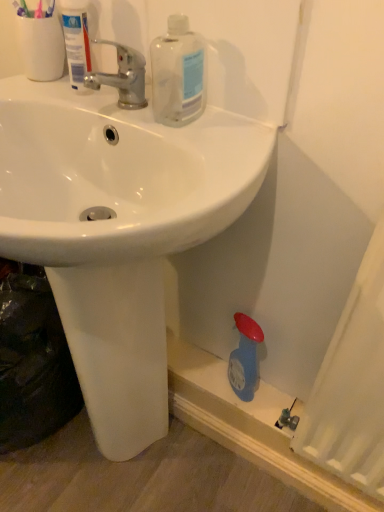
Find the location of a particular element. The height and width of the screenshot is (512, 384). free spot to the right of chrome metallic faucet at upper center is located at coordinates (193, 124).